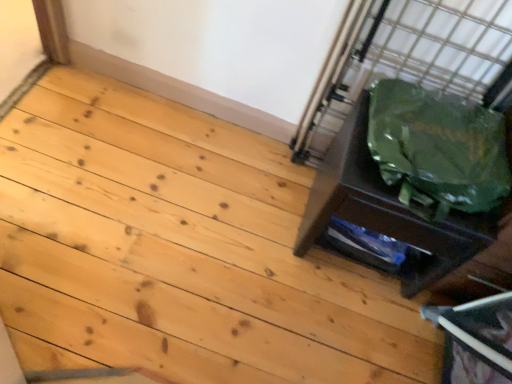
Locate an element on the screen. The height and width of the screenshot is (384, 512). free region under natural wood floor at lower right (from a real-world perspective) is located at coordinates (198, 269).